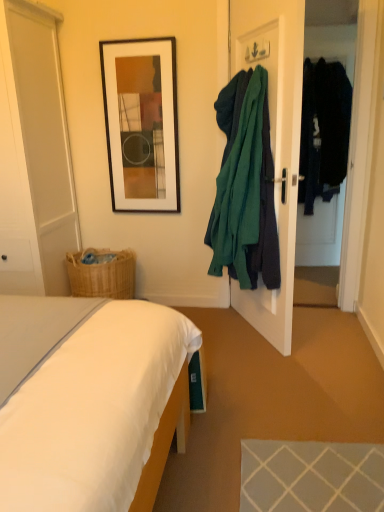
This screenshot has width=384, height=512. Describe the element at coordinates (331, 32) in the screenshot. I see `transparent glass door at right, marked as the 1th glass door in a right-to-left arrangement` at that location.

The image size is (384, 512). Identify the location of dark blue fabric coat at right, arranged as the 2th clothing when viewed from the front. (324, 131).

The height and width of the screenshot is (512, 384). In order to click on black matte picture frame at upper center in this screenshot , I will do `click(141, 124)`.

The width and height of the screenshot is (384, 512). Describe the element at coordinates (245, 186) in the screenshot. I see `teal fabric coat at right, the first clothing positioned from the left` at that location.

Image resolution: width=384 pixels, height=512 pixels. What do you see at coordinates (84, 398) in the screenshot?
I see `white fabric bed at lower left` at bounding box center [84, 398].

In order to face white fabric bed at lower left, should I rotate leftwards or rightwards?

Turn left approximately 19.538 degrees to face it.

In order to click on transparent glass door at right, positioned as the 2th glass door in left-to-right order in this screenshot , I will do `click(331, 32)`.

How much distance is there between black matte picture frame at upper center and white fabric bed at lower left?

black matte picture frame at upper center and white fabric bed at lower left are 1.67 meters apart from each other.

Between black matte picture frame at upper center and white fabric bed at lower left, which one has smaller width?

black matte picture frame at upper center is thinner.

Based on the photo, which of these two, black matte picture frame at upper center or white fabric bed at lower left, stands shorter?

white fabric bed at lower left is shorter.

Considering the relative positions of black matte picture frame at upper center and white fabric bed at lower left in the image provided, is black matte picture frame at upper center to the right of white fabric bed at lower left from the viewer's perspective?

Correct, you'll find black matte picture frame at upper center to the right of white fabric bed at lower left.

Considering the sizes of objects teal fabric coat at right, acting as the 2th clothing starting from the back, and white glossy door at left, the 2th glass door in the right-to-left sequence, in the image provided, who is taller, teal fabric coat at right, acting as the 2th clothing starting from the back, or white glossy door at left, the 2th glass door in the right-to-left sequence,?

Standing taller between the two is white glossy door at left, the 2th glass door in the right-to-left sequence.

Is white glossy door at left, placed as the first glass door when sorted from left to right, at the back of teal fabric coat at right, positioned as the first clothing in front-to-back order?

teal fabric coat at right, positioned as the first clothing in front-to-back order, is not turned away from white glossy door at left, placed as the first glass door when sorted from left to right.

Is teal fabric coat at right, the first clothing positioned from the left, wider or thinner than white glossy door at left, placed as the first glass door when sorted from left to right?

In the image, teal fabric coat at right, the first clothing positioned from the left, appears to be more narrow than white glossy door at left, placed as the first glass door when sorted from left to right.

Which object is more forward, teal fabric coat at right, the first clothing positioned from the left, or white glossy door at left, the 2th glass door in the right-to-left sequence?

Positioned in front is teal fabric coat at right, the first clothing positioned from the left.

From the image's perspective, is white glossy door at left, the 2th glass door in the right-to-left sequence, located beneath dark blue fabric coat at right, marked as the first clothing in a back-to-front arrangement?

Yes, from the image's perspective, white glossy door at left, the 2th glass door in the right-to-left sequence, is below dark blue fabric coat at right, marked as the first clothing in a back-to-front arrangement.

Is white glossy door at left, the 2th glass door in the right-to-left sequence, facing away from dark blue fabric coat at right, marked as the 1th clothing in a right-to-left arrangement?

No, white glossy door at left, the 2th glass door in the right-to-left sequence,'s orientation is not away from dark blue fabric coat at right, marked as the 1th clothing in a right-to-left arrangement.

From a real-world perspective, between white glossy door at left, placed as the first glass door when sorted from left to right, and dark blue fabric coat at right, marked as the first clothing in a back-to-front arrangement, who is vertically higher?

dark blue fabric coat at right, marked as the first clothing in a back-to-front arrangement, from a real-world perspective.

Is the depth of white glossy door at left, the 2th glass door in the right-to-left sequence, greater than that of dark blue fabric coat at right, which ranks as the 2th clothing in left-to-right order?

No, the depth of white glossy door at left, the 2th glass door in the right-to-left sequence, is less than that of dark blue fabric coat at right, which ranks as the 2th clothing in left-to-right order.

Can you tell me how much transparent glass door at right, positioned as the 2th glass door in left-to-right order, and teal fabric coat hanger at right differ in facing direction?

70.3 degrees.

Considering the sizes of objects transparent glass door at right, positioned as the 2th glass door in left-to-right order, and teal fabric coat hanger at right in the image provided, who is bigger, transparent glass door at right, positioned as the 2th glass door in left-to-right order, or teal fabric coat hanger at right?

teal fabric coat hanger at right.

In the image, is transparent glass door at right, positioned as the 2th glass door in left-to-right order, on the left side or the right side of teal fabric coat hanger at right?

Clearly, transparent glass door at right, positioned as the 2th glass door in left-to-right order, is on the right of teal fabric coat hanger at right in the image.

Which is in front, point (321, 255) or point (250, 304)?

The point (250, 304) is more forward.

Between white fabric bed at lower left and teal fabric coat at right, positioned as the first clothing in front-to-back order, which one appears on the right side from the viewer's perspective?

teal fabric coat at right, positioned as the first clothing in front-to-back order, is more to the right.

Find the location of `bed located below the teal fabric coat at right, the first clothing positioned from the left (from the image's perspective)`. bed located below the teal fabric coat at right, the first clothing positioned from the left (from the image's perspective) is located at coordinates (84, 398).

From the picture: Is white fabric bed at lower left looking in the opposite direction of teal fabric coat at right, the 2th clothing when ordered from right to left?

That's not correct — white fabric bed at lower left is not looking away from teal fabric coat at right, the 2th clothing when ordered from right to left.

From a real-world perspective, is white fabric bed at lower left positioned under teal fabric coat at right, the 2th clothing when ordered from right to left, based on gravity?

Yes, from a real-world perspective, white fabric bed at lower left is below teal fabric coat at right, the 2th clothing when ordered from right to left.

From a real-world perspective, who is located lower, white glossy door at left, placed as the first glass door when sorted from left to right, or white fabric bed at lower left?

white fabric bed at lower left is physically lower.

Based on the photo, from the image's perspective, is white glossy door at left, placed as the first glass door when sorted from left to right, located beneath white fabric bed at lower left?

Actually, white glossy door at left, placed as the first glass door when sorted from left to right, appears above white fabric bed at lower left in the image.

Does point (24, 133) come farther from viewer compared to point (83, 366)?

Yes, it is.

Is white fabric bed at lower left completely or partially inside white glossy door at left, the 2th glass door in the right-to-left sequence?

Actually, white fabric bed at lower left is outside white glossy door at left, the 2th glass door in the right-to-left sequence.

Could white glossy door at left, placed as the first glass door when sorted from left to right, be considered to be inside transparent glass door at right, positioned as the 2th glass door in left-to-right order?

No, transparent glass door at right, positioned as the 2th glass door in left-to-right order, does not contain white glossy door at left, placed as the first glass door when sorted from left to right.

The height and width of the screenshot is (512, 384). I want to click on glass door lying below the transparent glass door at right, positioned as the 2th glass door in left-to-right order (from the image's perspective), so click(34, 155).

Considering the relative sizes of transparent glass door at right, marked as the 1th glass door in a right-to-left arrangement, and white glossy door at left, placed as the first glass door when sorted from left to right, in the image provided, is transparent glass door at right, marked as the 1th glass door in a right-to-left arrangement, thinner than white glossy door at left, placed as the first glass door when sorted from left to right,?

Yes.

Identify the location of bed in front of the black matte picture frame at upper center. The height and width of the screenshot is (512, 384). (84, 398).

Find the location of `clothing lying below the white glossy door at left, the 2th glass door in the right-to-left sequence (from the image's perspective)`. clothing lying below the white glossy door at left, the 2th glass door in the right-to-left sequence (from the image's perspective) is located at coordinates (245, 186).

In the scene shown: Based on their spatial positions, is transparent glass door at right, marked as the 1th glass door in a right-to-left arrangement, or white fabric bed at lower left closer to dark blue fabric coat at right, marked as the first clothing in a back-to-front arrangement?

transparent glass door at right, marked as the 1th glass door in a right-to-left arrangement, is positioned closer to the anchor dark blue fabric coat at right, marked as the first clothing in a back-to-front arrangement.

Considering their positions, is teal fabric coat hanger at right positioned further to white fabric bed at lower left than white glossy door at left, the 2th glass door in the right-to-left sequence?

Among the two, white glossy door at left, the 2th glass door in the right-to-left sequence, is located further to white fabric bed at lower left.

Estimate the real-world distances between objects in this image. Which object is closer to black matte picture frame at upper center, transparent glass door at right, positioned as the 2th glass door in left-to-right order, or white fabric bed at lower left?

The object closer to black matte picture frame at upper center is transparent glass door at right, positioned as the 2th glass door in left-to-right order.

Which object lies further to the anchor point teal fabric coat hanger at right, black matte picture frame at upper center or transparent glass door at right, marked as the 1th glass door in a right-to-left arrangement?

Based on the image, transparent glass door at right, marked as the 1th glass door in a right-to-left arrangement, appears to be further to teal fabric coat hanger at right.

When comparing their distances from white fabric bed at lower left, does teal fabric coat hanger at right or teal fabric coat at right, the first clothing positioned from the left, seem further?

The object further to white fabric bed at lower left is teal fabric coat hanger at right.

Considering their positions, is teal fabric coat at right, positioned as the first clothing in front-to-back order, positioned further to dark blue fabric coat at right, which ranks as the 2th clothing in left-to-right order, than teal fabric coat hanger at right?

teal fabric coat at right, positioned as the first clothing in front-to-back order.

Looking at this image, based on their spatial positions, is teal fabric coat at right, the 2th clothing when ordered from right to left, or transparent glass door at right, positioned as the 2th glass door in left-to-right order, further from teal fabric coat hanger at right?

transparent glass door at right, positioned as the 2th glass door in left-to-right order, is positioned further to the anchor teal fabric coat hanger at right.

Based on their spatial positions, is black matte picture frame at upper center or transparent glass door at right, positioned as the 2th glass door in left-to-right order, closer to dark blue fabric coat at right, marked as the 1th clothing in a right-to-left arrangement?

Based on the image, transparent glass door at right, positioned as the 2th glass door in left-to-right order, appears to be nearer to dark blue fabric coat at right, marked as the 1th clothing in a right-to-left arrangement.

I want to click on door between white glossy door at left, placed as the first glass door when sorted from left to right, and transparent glass door at right, positioned as the 2th glass door in left-to-right order, so click(x=274, y=144).

Find the location of a particular element. Image resolution: width=384 pixels, height=512 pixels. clothing between white fabric bed at lower left and dark blue fabric coat at right, arranged as the 2th clothing when viewed from the front, along the z-axis is located at coordinates (245, 186).

This screenshot has height=512, width=384. I want to click on clothing between white glossy door at left, the 2th glass door in the right-to-left sequence, and dark blue fabric coat at right, marked as the first clothing in a back-to-front arrangement, so click(245, 186).

This screenshot has height=512, width=384. Find the location of `clothing positioned between white fabric bed at lower left and black matte picture frame at upper center from near to far`. clothing positioned between white fabric bed at lower left and black matte picture frame at upper center from near to far is located at coordinates (245, 186).